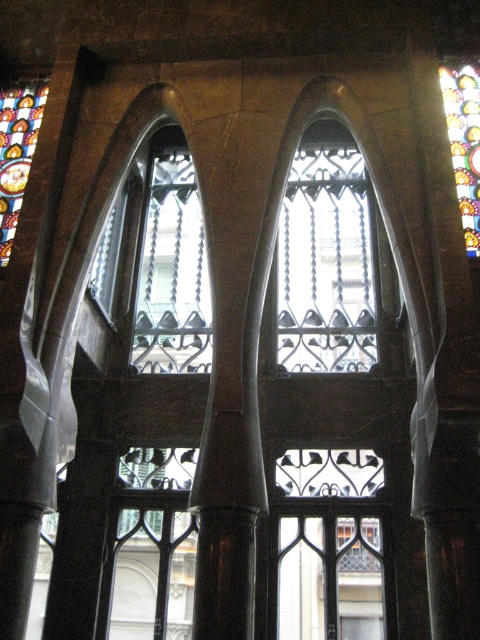
Does dark brown stone pillar at center appear on the right side of stained glass window at upper left?

Yes, dark brown stone pillar at center is to the right of stained glass window at upper left.

Is dark brown stone pillar at center shorter than stained glass window at upper left?

No, dark brown stone pillar at center is not shorter than stained glass window at upper left.

This screenshot has height=640, width=480. I want to click on dark brown stone pillar at center, so click(233, 420).

Based on the photo, is dark brown stone pillar at center smaller than clear glass window at center?

Yes, dark brown stone pillar at center is smaller than clear glass window at center.

Does point (210, 228) lie in front of point (335, 244)?

That is True.

Locate an element on the screen. This screenshot has height=640, width=480. dark brown stone pillar at center is located at coordinates (233, 420).

In the scene shown: Is dark brown stone pillar at center to the right of stained glass window at upper right from the viewer's perspective?

No, dark brown stone pillar at center is not to the right of stained glass window at upper right.

I want to click on dark brown stone pillar at center, so click(233, 420).